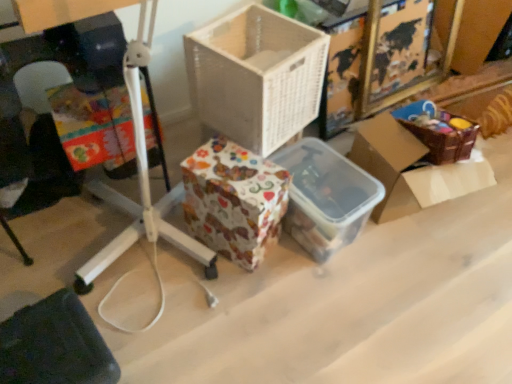
In order to click on vacant area that lies in front of translucent plastic container at center, which is the 2th storage box from left to right in this screenshot , I will do `click(315, 301)`.